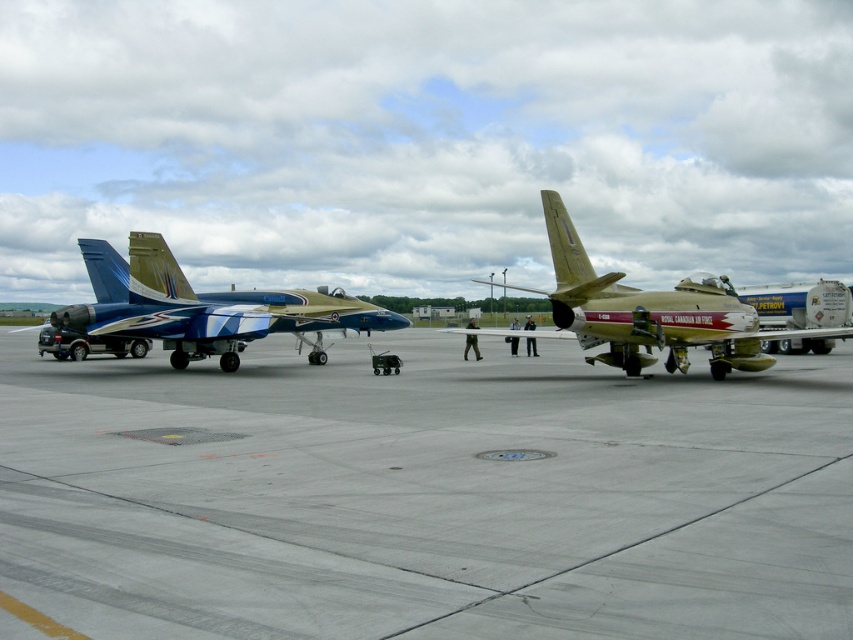
You are a maintenance worker on the gray concrete tarmac at center. You need to inspect the shiny blue and white fighter jet at center. Can you walk directly underneath it without any obstruction?

The gray concrete tarmac at center is positioned under the shiny blue and white fighter jet at center, so yes, you can walk directly underneath it since the tarmac is beneath the jet.

You are a pilot trying to taxi your small plane to the runway. You see the gray concrete tarmac at center and the shiny blue and white fighter jet at center. Which one is wider so you can choose the best path?

The gray concrete tarmac at center might be wider than shiny blue and white fighter jet at center, so you should choose the gray concrete tarmac at center for taxiing.